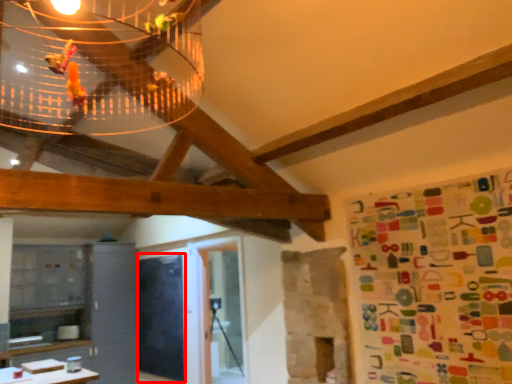
Question: From the image's perspective, what is the correct spatial relationship of bulletin board (annotated by the red box) in relation to wrapping paper?

Choices:
 (A) below
 (B) above

Answer: (A)